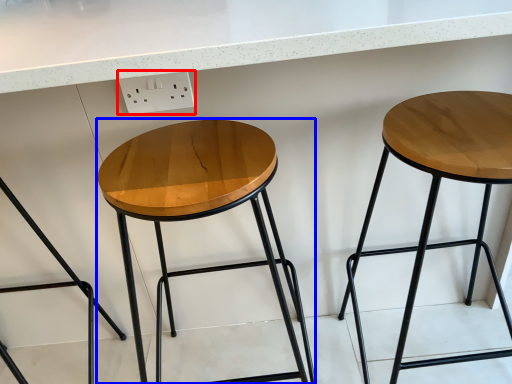
Question: Which object appears closest to the camera in this image, electric outlet (highlighted by a red box) or stool (highlighted by a blue box)?

Choices:
 (A) electric outlet
 (B) stool

Answer: (B)